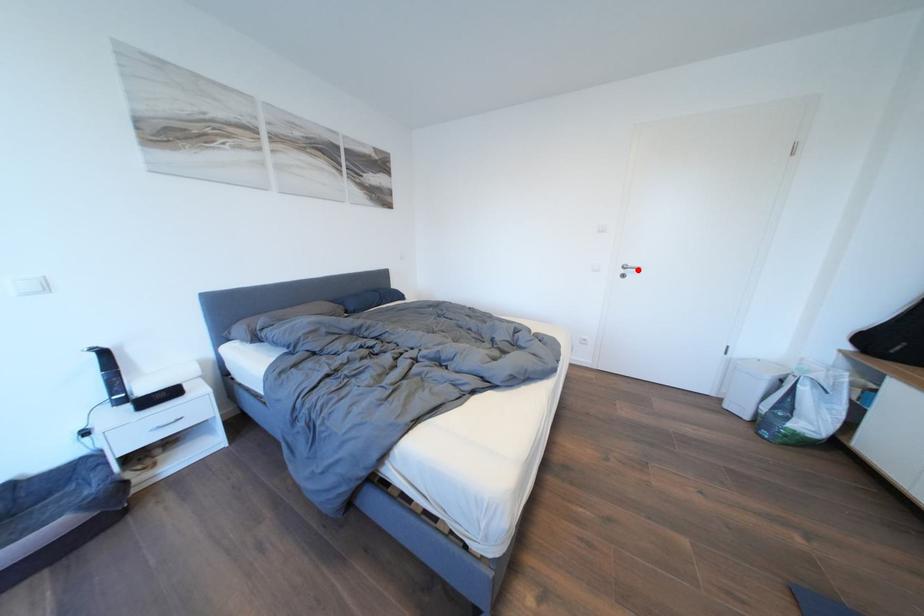
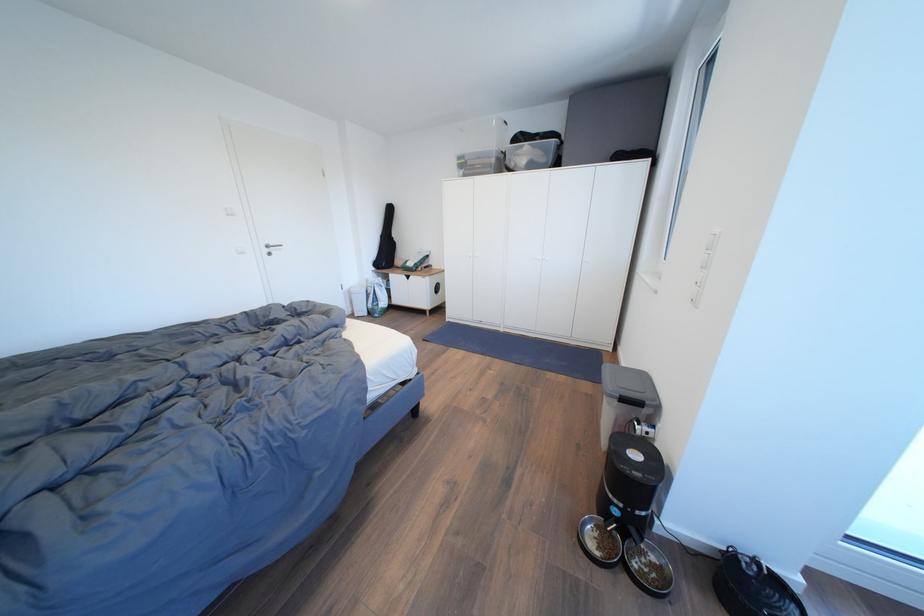
Question: I am providing you with two images of the same scene from different viewpoints. Given a red point in image1, look at the same physical point in image2. Is it:

Choices:
 (A) Closer to the viewpoint
 (B) Farther from the viewpoint

Answer: (A)